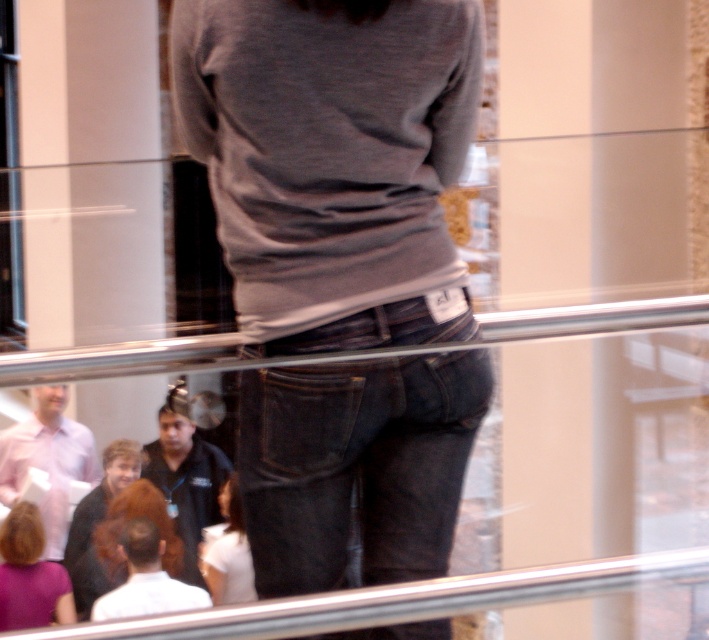
You are a security camera positioned behind the glass barrier. You need to determine which object is closer to you between the dark blue denim jeans at center and the white matte shirt at center. Which one is closer?

The dark blue denim jeans at center is closer to the viewer than the white matte shirt at center.